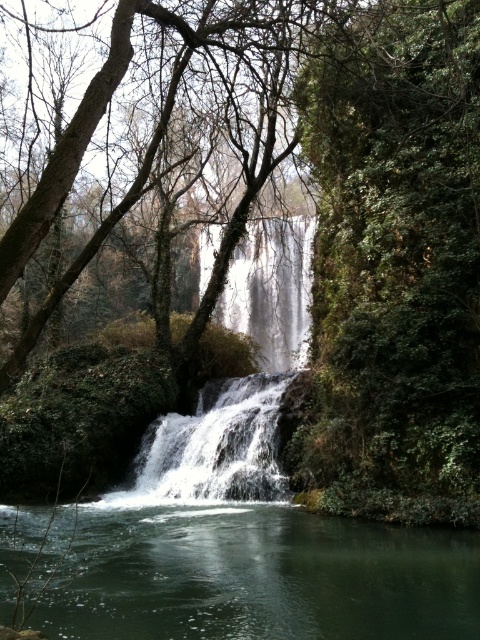
Question: Considering the relative positions of clear water at center and white frothy water at center in the image provided, where is clear water at center located with respect to white frothy water at center?

Choices:
 (A) right
 (B) left

Answer: (A)

Question: Among these points, which one is farthest from the camera?

Choices:
 (A) (251, 420)
 (B) (352, 378)
 (C) (357, 604)

Answer: (A)

Question: From the image, what is the correct spatial relationship of green leafy tree at center in relation to clear water at center?

Choices:
 (A) right
 (B) left

Answer: (A)

Question: Considering the real-world distances, which object is closest to the clear water at center?

Choices:
 (A) white frothy water at center
 (B) green leafy tree at center

Answer: (A)

Question: Considering the relative positions of clear water at center and white frothy water at center in the image provided, where is clear water at center located with respect to white frothy water at center?

Choices:
 (A) below
 (B) above

Answer: (A)

Question: Which object appears farthest from the camera in this image?

Choices:
 (A) green leafy tree at center
 (B) clear water at center

Answer: (A)